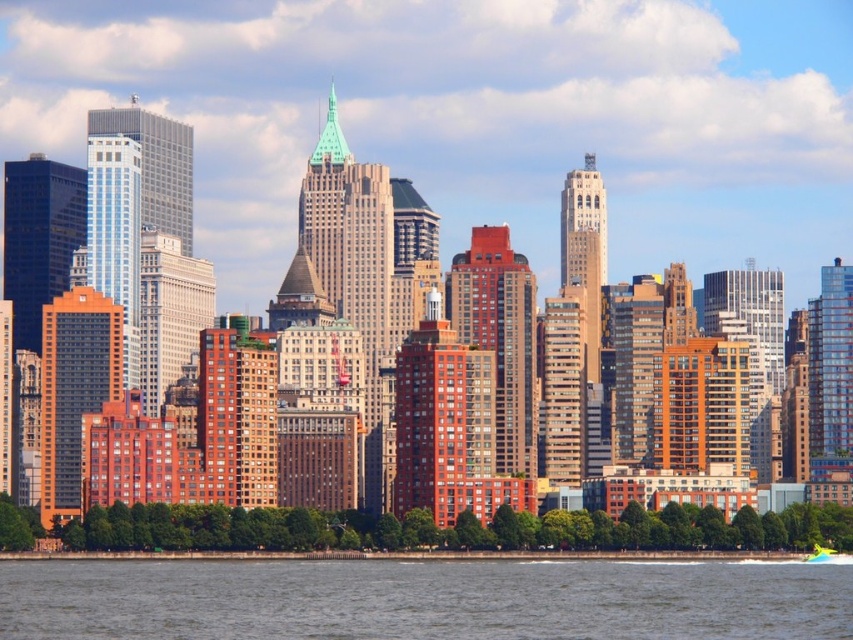
Who is taller, gray water at lower center or green plastic boat at lower right?

gray water at lower center is taller.

Is gray water at lower center below green plastic boat at lower right?

Correct, gray water at lower center is located below green plastic boat at lower right.

Does point (602, 596) come closer to viewer compared to point (834, 557)?

Yes, it is in front of point (834, 557).

Where is `gray water at lower center`? gray water at lower center is located at coordinates (422, 600).